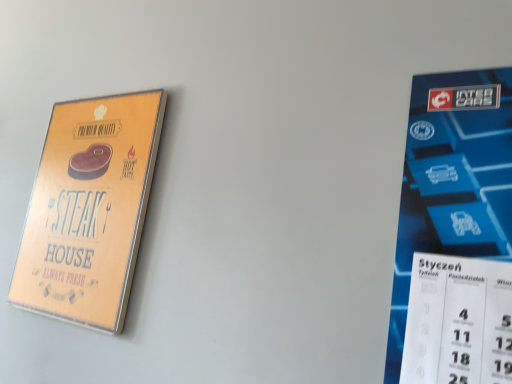
The width and height of the screenshot is (512, 384). I want to click on matte cardboard poster at left, so click(89, 210).

Describe the element at coordinates (89, 210) in the screenshot. This screenshot has width=512, height=384. I see `matte cardboard poster at left` at that location.

Locate an element on the screen. matte cardboard poster at left is located at coordinates (89, 210).